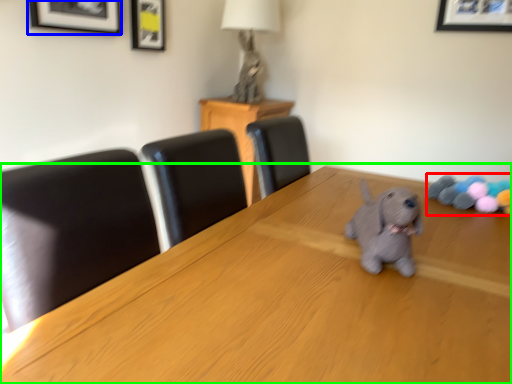
Question: Considering the real-world distances, which object is farthest from toy (highlighted by a red box)? picture frame (highlighted by a blue box) or table (highlighted by a green box)?

Choices:
 (A) picture frame
 (B) table

Answer: (A)